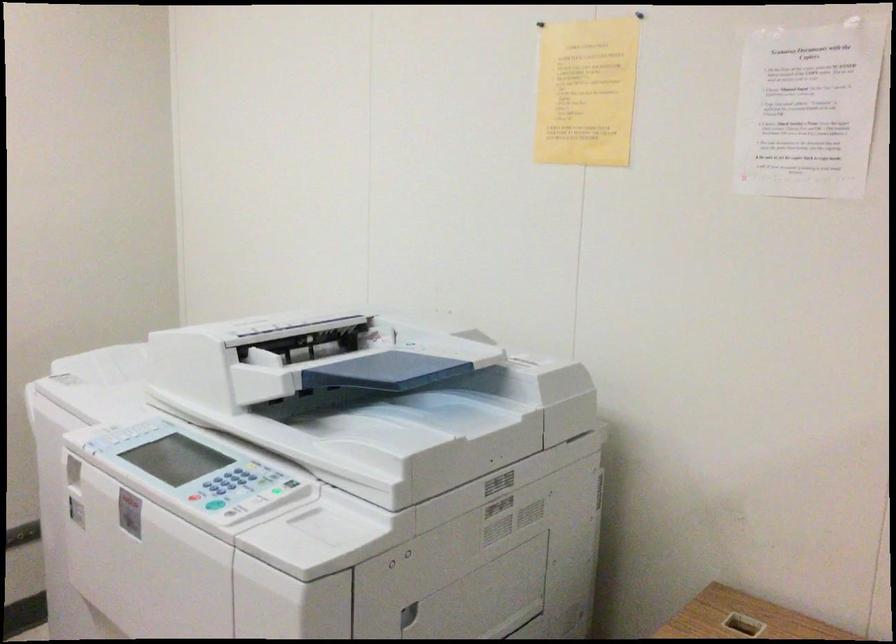
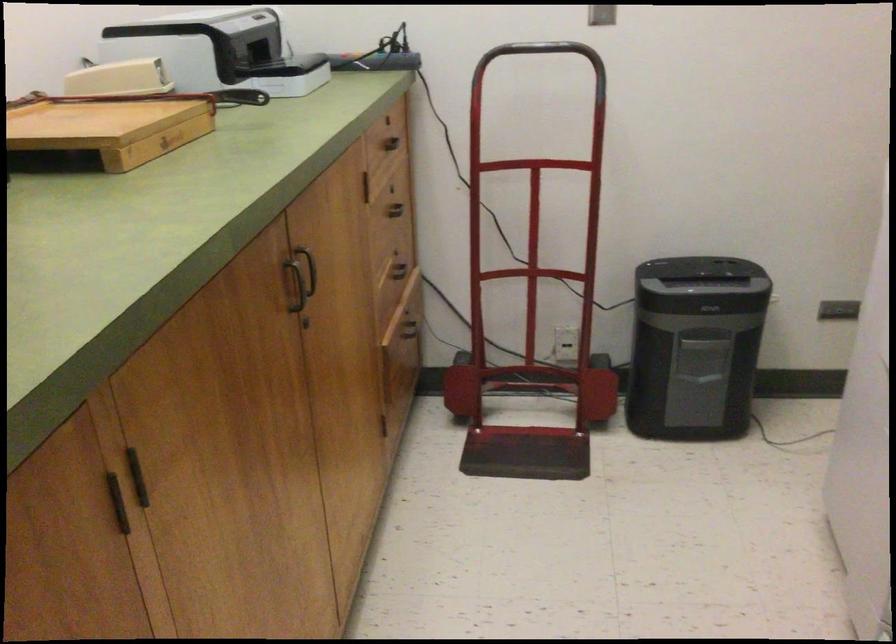
The images are taken continuously from a first-person perspective. In which direction is your viewpoint rotating?

The rotation direction of the camera is left-down.